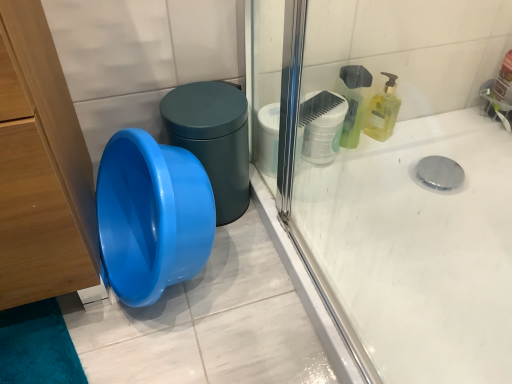
Question: Visually, is white matte toilet paper at upper right positioned to the left or to the right of blue glossy potty at center left?

Choices:
 (A) right
 (B) left

Answer: (A)

Question: Based on their sizes in the image, would you say white matte toilet paper at upper right is bigger or smaller than blue glossy potty at center left?

Choices:
 (A) small
 (B) big

Answer: (A)

Question: Which object is positioned closest to the white matte toilet paper at upper right?

Choices:
 (A) silver metallic faucet at upper right
 (B) yellow translucent liquid soap at upper right
 (C) blue glossy potty at center left

Answer: (B)

Question: Which object is the closest to the yellow translucent liquid soap at upper right?

Choices:
 (A) silver metallic faucet at upper right
 (B) white matte toilet paper at upper right
 (C) blue glossy potty at center left

Answer: (B)